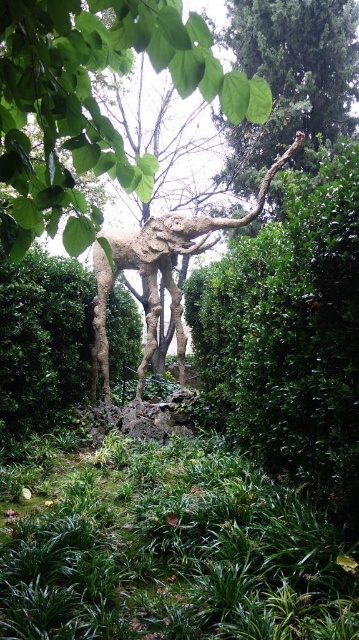
Between point (325, 589) and point (230, 28), which one is positioned in front?

Point (325, 589) is more forward.

Is green leafy grass at lower center closer to the viewer compared to green rough bark tree at upper center?

Yes, it is.

Identify the location of green leafy grass at lower center. (175, 556).

Does green leafy grass at lower center have a greater width compared to green leafy bush at center?

Yes.

Who is more forward, (245, 472) or (254, 342)?

Positioned in front is point (254, 342).

Which is in front, point (266, 554) or point (203, 328)?

Point (266, 554)

The image size is (359, 640). Identify the location of green leafy grass at lower center. pyautogui.click(x=175, y=556).

Between rough bark tree at upper center and green rough bark tree at upper center, which one is positioned lower?

rough bark tree at upper center

Between rough bark tree at upper center and green rough bark tree at upper center, which one is positioned higher?

green rough bark tree at upper center is above.

Based on the photo, who is more distant from viewer, (34,77) or (250,172)?

The point (250,172) is behind.

The width and height of the screenshot is (359, 640). I want to click on rough bark tree at upper center, so click(x=91, y=102).